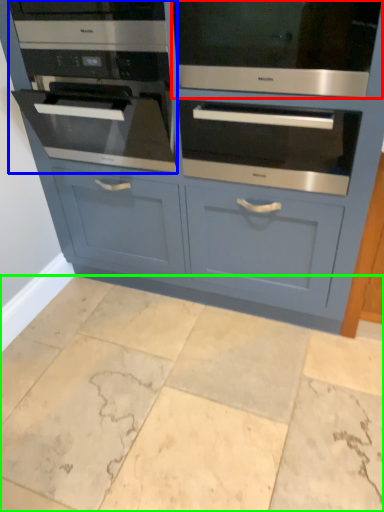
Question: Estimate the real-world distances between objects in this image. Which object is closer to oven (highlighted by a red box), oven (highlighted by a blue box) or ceramic tile (highlighted by a green box)?

Choices:
 (A) oven
 (B) ceramic tile

Answer: (A)